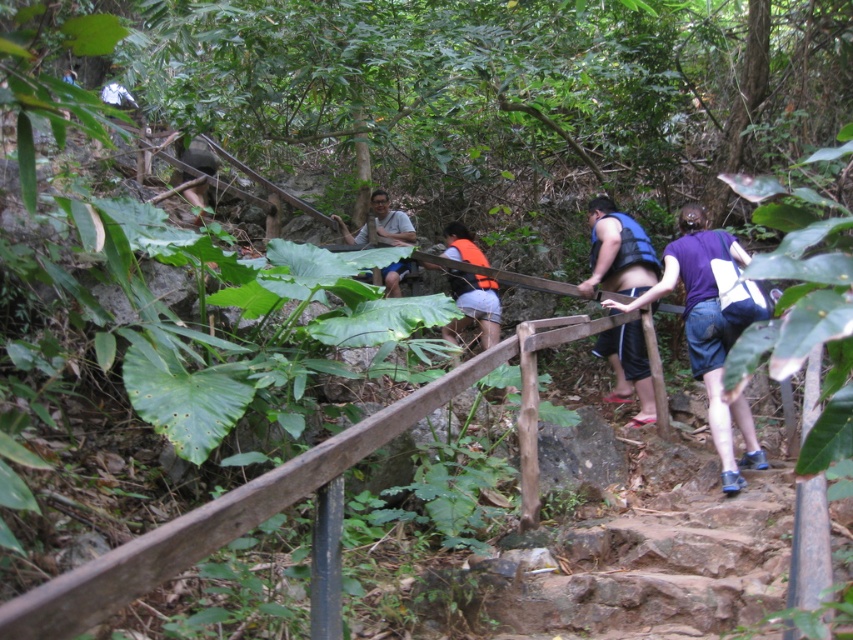
You are a hiker carrying a backpack and need to pass through a narrow section of the rocky staircase. The blue fabric shorts at center and the orange life vest at center are blocking your path. Given that your backpack is 2 meters wide, can you navigate around them without moving the objects?

The distance between the blue fabric shorts at center and orange life vest at center is 1.95 meters. Since your backpack is 2 meters wide, it is slightly wider than the available space. Therefore, you cannot navigate around them without moving the objects.